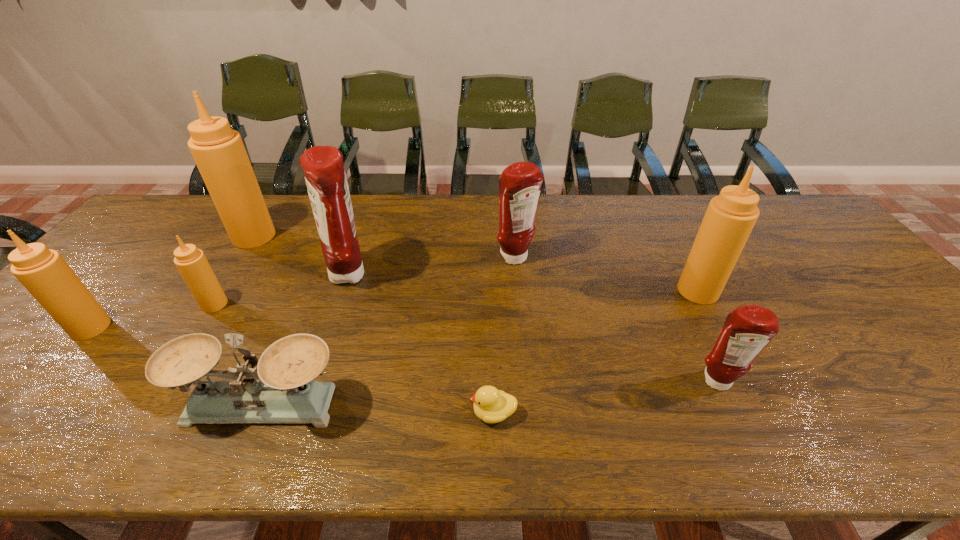
Identify the location of vacant space at the near edge of the desktop. The width and height of the screenshot is (960, 540). (35, 429).

Where is `vacant position at the right edge of the desktop`? The image size is (960, 540). vacant position at the right edge of the desktop is located at coordinates (852, 280).

This screenshot has height=540, width=960. I want to click on blank area at the far right corner, so click(x=788, y=199).

Find the location of a particular element. The width and height of the screenshot is (960, 540). free space between the second smallest tan condiment and the farthest tan condiment is located at coordinates (173, 282).

Image resolution: width=960 pixels, height=540 pixels. I want to click on free spot between the smallest tan condiment and the second smallest red condiment, so click(365, 281).

Where is `free space between the scale and the second biggest tan condiment`? The height and width of the screenshot is (540, 960). free space between the scale and the second biggest tan condiment is located at coordinates (481, 347).

Locate an element on the screen. The image size is (960, 540). free space between the smallest tan condiment and the tallest condiment is located at coordinates (234, 270).

Locate an element on the screen. vacant region between the smallest tan condiment and the rightmost red condiment is located at coordinates (466, 343).

This screenshot has width=960, height=540. I want to click on vacant area that lies between the yellow duckling and the smallest tan condiment, so click(x=354, y=359).

Where is `vacant region between the biggest red condiment and the farthest tan condiment`? Image resolution: width=960 pixels, height=540 pixels. vacant region between the biggest red condiment and the farthest tan condiment is located at coordinates (301, 255).